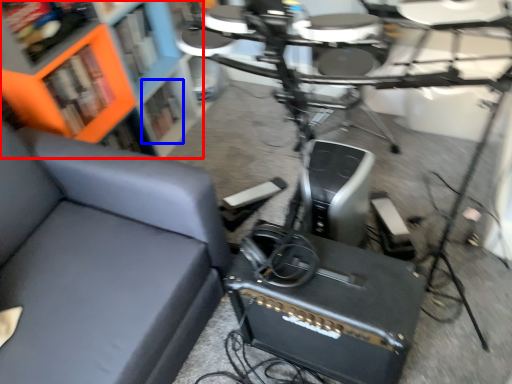
Question: Which point is closer to the camera, bookcase (highlighted by a red box) or shelf (highlighted by a blue box)?

Choices:
 (A) bookcase
 (B) shelf

Answer: (A)